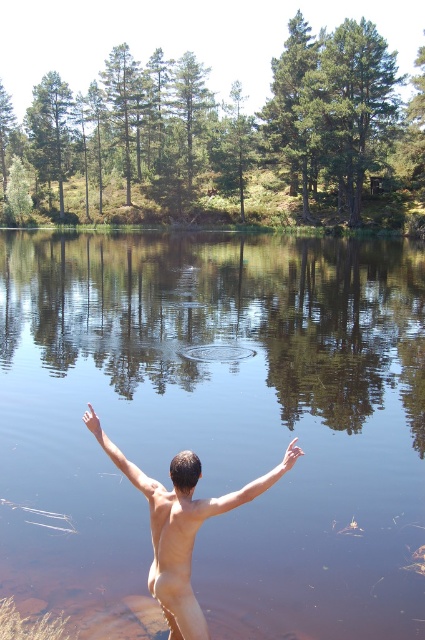
Does transparent water at center appear over skinny flesh at upper center?

Correct, transparent water at center is located above skinny flesh at upper center.

Can you confirm if transparent water at center is positioned to the right of skinny flesh at upper center?

No, transparent water at center is not to the right of skinny flesh at upper center.

Locate an element on the screen. This screenshot has width=425, height=640. transparent water at center is located at coordinates (217, 426).

Does skinny nude man at center have a lesser height compared to skinny flesh at upper center?

No.

Is point (164, 541) positioned before point (138, 483)?

Yes, it is in front of point (138, 483).

At what (x,y) coordinates should I click in order to perform the action: click on skinny nude man at center. Please return your answer as a coordinate pair (x, y). The height and width of the screenshot is (640, 425). Looking at the image, I should click on (181, 525).

The height and width of the screenshot is (640, 425). In order to click on skinny nude man at center in this screenshot , I will do `click(181, 525)`.

Which is above, skinny nude man at center or skinny tan arm at center?

skinny tan arm at center

Does skinny nude man at center have a larger size compared to skinny tan arm at center?

Correct, skinny nude man at center is larger in size than skinny tan arm at center.

Is point (189, 621) farther from viewer compared to point (210, 506)?

Yes, point (189, 621) is behind point (210, 506).

Find the location of a particular element. skinny nude man at center is located at coordinates (181, 525).